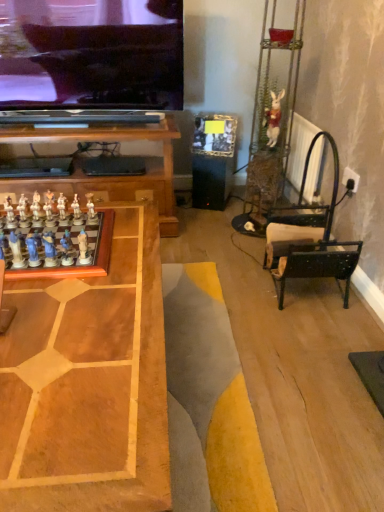
What do you see at coordinates (90, 206) in the screenshot?
I see `white glossy chess piece at center-left, which is the 3th toy from right to left` at bounding box center [90, 206].

What do you see at coordinates (9, 210) in the screenshot?
I see `white glossy chess piece at left, which is the first toy from left to right` at bounding box center [9, 210].

In order to click on matte blue chess pieces at left, marked as the eleventh toy in a back-to-front arrangement in this screenshot , I will do `click(16, 251)`.

The image size is (384, 512). In order to click on blue glossy chess piece at left, the sixth toy when ordered from right to left in this screenshot , I will do `click(49, 250)`.

In order to face wooden chessboard at center, should I rotate leftwards or rightwards?

Turn left by 18.895 degrees to look at wooden chessboard at center.

In order to face matte blue chess piece at left, marked as the 3th toy in a front-to-back arrangement, should I rotate leftwards or rightwards?

Rotate your view left by about 20.567°.

Image resolution: width=384 pixels, height=512 pixels. Identify the location of white glossy chess piece at center-left, marked as the 10th toy in a front-to-back arrangement. (90, 206).

Locate an element on the screen. This screenshot has height=512, width=384. table in front of the white glossy chess pieces at left, arranged as the 5th toy when viewed from the right is located at coordinates (88, 384).

From a real-world perspective, is white glossy chess pieces at left, arranged as the 5th toy when viewed from the right, positioned over wooden chessboard at center based on gravity?

Yes, from a real-world perspective, white glossy chess pieces at left, arranged as the 5th toy when viewed from the right, is over wooden chessboard at center

Can you confirm if white glossy chess pieces at left, the third toy from the back, is positioned to the right of wooden chessboard at center?

Indeed, white glossy chess pieces at left, the third toy from the back, is positioned on the right side of wooden chessboard at center.

How distant is white glossy chess pieces at left, the ninth toy positioned from the front, from wooden chessboard at center?

white glossy chess pieces at left, the ninth toy positioned from the front, is 23.04 inches from wooden chessboard at center.

From a real-world perspective, which object stands above the other?

From a 3D spatial view, white glossy chess piece at center-left, marked as the seventh toy in a back-to-front arrangement, is above.

Is wooden chessboard at center turned away from white glossy chess piece at center-left, which is counted as the tenth toy, starting from the left?

No.

Can white glossy chess piece at center-left, marked as the seventh toy in a back-to-front arrangement, be found inside wooden chessboard at center?

No, white glossy chess piece at center-left, marked as the seventh toy in a back-to-front arrangement, is not surrounded by wooden chessboard at center.

Which of these two, matte blue chess pieces at left, marked as the first toy in a front-to-back arrangement, or white glossy chess piece at center-left, marked as the 10th toy in a front-to-back arrangement, is smaller?

With smaller size is matte blue chess pieces at left, marked as the first toy in a front-to-back arrangement.

What's the angular difference between matte blue chess pieces at left, the third toy when ordered from left to right, and white glossy chess piece at center-left, which ranks as the second toy in back-to-front order,'s facing directions?

matte blue chess pieces at left, the third toy when ordered from left to right, and white glossy chess piece at center-left, which ranks as the second toy in back-to-front order, are facing 178 degrees away from each other.

Is matte blue chess pieces at left, the third toy when ordered from left to right, positioned behind white glossy chess piece at center-left, the ninth toy from the left?

No, it is in front of white glossy chess piece at center-left, the ninth toy from the left.

Does point (65, 249) come farther from viewer compared to point (77, 202)?

No, (65, 249) is in front of (77, 202).

The height and width of the screenshot is (512, 384). In order to click on game lying below the white glossy chess pieces at left, the 7th toy when ordered from left to right (from the image's perspective) in this screenshot , I will do `click(49, 238)`.

From the image's perspective, between white glossy chess set at lower left and white glossy chess pieces at left, the third toy from the back, which one is located above?

A: white glossy chess pieces at left, the third toy from the back, is shown above in the image.

Is white glossy chess set at lower left facing towards white glossy chess pieces at left, arranged as the 5th toy when viewed from the right?

No, white glossy chess set at lower left is not aimed at white glossy chess pieces at left, arranged as the 5th toy when viewed from the right.

Which object is wider, white glossy chess piece at left, which is the first toy from left to right, or matte blue chess piece at left, the eighth toy in the left-to-right sequence?

With larger width is matte blue chess piece at left, the eighth toy in the left-to-right sequence.

From the image's perspective, relative to matte blue chess piece at left, which is counted as the fourth toy, starting from the right, is white glossy chess piece at left, the 11th toy when ordered from right to left, above or below?

From the image's perspective, white glossy chess piece at left, the 11th toy when ordered from right to left, appears above matte blue chess piece at left, which is counted as the fourth toy, starting from the right.

Is matte blue chess piece at left, which is the eighth toy from back to front, a part of white glossy chess piece at left, which ranks as the 6th toy in back-to-front order?

No, white glossy chess piece at left, which ranks as the 6th toy in back-to-front order, does not contain matte blue chess piece at left, which is the eighth toy from back to front.

From a real-world perspective, is white fabric rabbit at upper right, which is the 11th toy in left-to-right order, under white glossy chess piece at left, marked as the 10th toy in a right-to-left arrangement?

Actually, white fabric rabbit at upper right, which is the 11th toy in left-to-right order, is physically above white glossy chess piece at left, marked as the 10th toy in a right-to-left arrangement, in the real world.

Is white fabric rabbit at upper right, which is the 11th toy in left-to-right order, taller or shorter than white glossy chess piece at left, placed as the seventh toy when sorted from front to back?

In the image, white fabric rabbit at upper right, which is the 11th toy in left-to-right order, appears to be taller than white glossy chess piece at left, placed as the seventh toy when sorted from front to back.

Based on the photo, measure the distance between white fabric rabbit at upper right, acting as the eleventh toy starting from the front, and white glossy chess piece at left, the fifth toy from the back.

They are 4.82 feet apart.

Is blue glossy chess piece at left, which ranks as the tenth toy in back-to-front order, not inside white glossy chess pieces at left, the 7th toy when ordered from left to right?

Yes, blue glossy chess piece at left, which ranks as the tenth toy in back-to-front order, is outside of white glossy chess pieces at left, the 7th toy when ordered from left to right.

Image resolution: width=384 pixels, height=512 pixels. There is a blue glossy chess piece at left, the sixth toy when ordered from right to left. In order to click on the 5th toy below it (from a real-world perspective) in this screenshot , I will do `click(76, 208)`.

From a real-world perspective, is blue glossy chess piece at left, the sixth toy from the left, located beneath white glossy chess pieces at left, the third toy from the back?

No.

The width and height of the screenshot is (384, 512). I want to click on table on the left side of white glossy chess pieces at left, arranged as the 5th toy when viewed from the right, so click(88, 384).

Where is `toy that is the 5th one when counting upward from the wooden chessboard at center (from the image's perspective)`? Image resolution: width=384 pixels, height=512 pixels. toy that is the 5th one when counting upward from the wooden chessboard at center (from the image's perspective) is located at coordinates (83, 248).

Looking at the image, which one is located closer to wooden chessboard at center, matte blue chess piece at left, the 4th toy viewed from the left, or blue glossy chess piece at left, the sixth toy when ordered from right to left?

blue glossy chess piece at left, the sixth toy when ordered from right to left.

When comparing their distances from white fabric rabbit at upper right, acting as the eleventh toy starting from the front, does white glossy chess set at lower left or matte blue chess pieces at left, marked as the eleventh toy in a back-to-front arrangement, seem further?

matte blue chess pieces at left, marked as the eleventh toy in a back-to-front arrangement.

When comparing their distances from white glossy chess piece at left, which is the first toy from left to right, does matte blue chess piece at left, which is counted as the fourth toy, starting from the right, or white glossy chess set at lower left seem further?

matte blue chess piece at left, which is counted as the fourth toy, starting from the right.

Considering their positions, is white glossy chess pieces at left, arranged as the 5th toy when viewed from the right, positioned further to matte blue chess piece at left, marked as the 3th toy in a front-to-back arrangement, than white glossy chess piece at center-left, the ninth toy from the left?

white glossy chess piece at center-left, the ninth toy from the left, lies further to matte blue chess piece at left, marked as the 3th toy in a front-to-back arrangement, than the other object.

Based on their spatial positions, is blue glossy chess piece at left, positioned as the second toy in front-to-back order, or white fabric rabbit at upper right, which is the 11th toy in left-to-right order, further from white glossy chess piece at left, which appears as the 7th toy when viewed from the right?

white fabric rabbit at upper right, which is the 11th toy in left-to-right order.

From the image, which object appears to be nearer to white glossy chess piece at center-left, marked as the seventh toy in a back-to-front arrangement, matte blue chess piece at left, which is counted as the fourth toy, starting from the right, or white glossy chess piece at left, which is the second toy from left to right?

Based on the image, matte blue chess piece at left, which is counted as the fourth toy, starting from the right, appears to be nearer to white glossy chess piece at center-left, marked as the seventh toy in a back-to-front arrangement.

Which object lies nearer to the anchor point matte blue chess piece at left, which ranks as the fourth toy in front-to-back order, white glossy chess set at lower left or white glossy chess piece at left, placed as the seventh toy when sorted from front to back?

Based on the image, white glossy chess set at lower left appears to be nearer to matte blue chess piece at left, which ranks as the fourth toy in front-to-back order.

Based on their spatial positions, is wooden chessboard at center or matte blue chess piece at left, acting as the 9th toy starting from the back, closer to matte blue chess pieces at left, marked as the eleventh toy in a back-to-front arrangement?

matte blue chess piece at left, acting as the 9th toy starting from the back, lies closer to matte blue chess pieces at left, marked as the eleventh toy in a back-to-front arrangement, than the other object.

Identify the location of game located between wooden chessboard at center and matte blue chess pieces at left, marked as the eleventh toy in a back-to-front arrangement, in the depth direction. This screenshot has width=384, height=512. (49, 238).

Where is `game between matte blue chess pieces at left, marked as the first toy in a front-to-back arrangement, and blue glossy chess piece at left, which ranks as the tenth toy in back-to-front order`? Image resolution: width=384 pixels, height=512 pixels. game between matte blue chess pieces at left, marked as the first toy in a front-to-back arrangement, and blue glossy chess piece at left, which ranks as the tenth toy in back-to-front order is located at coordinates coord(49,238).

At what (x,y) coordinates should I click in order to perform the action: click on game positioned between wooden chessboard at center and blue glossy chess piece at left, the sixth toy from the left, from near to far. Please return your answer as a coordinate pair (x, y). Image resolution: width=384 pixels, height=512 pixels. Looking at the image, I should click on (49, 238).

Locate an element on the screen. This screenshot has width=384, height=512. game positioned between wooden chessboard at center and white glossy chess pieces at left, the third toy from the back, from near to far is located at coordinates (49, 238).